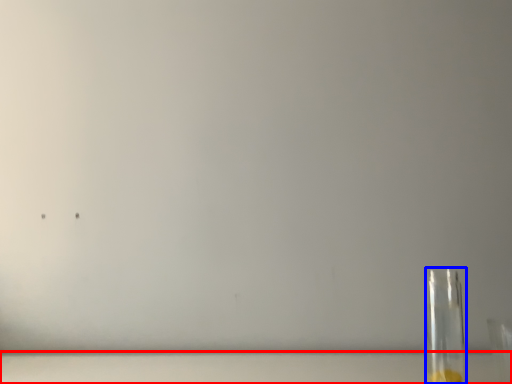
Question: Which object is closer to the camera taking this photo, table top (highlighted by a red box) or bottle (highlighted by a blue box)?

Choices:
 (A) table top
 (B) bottle

Answer: (B)